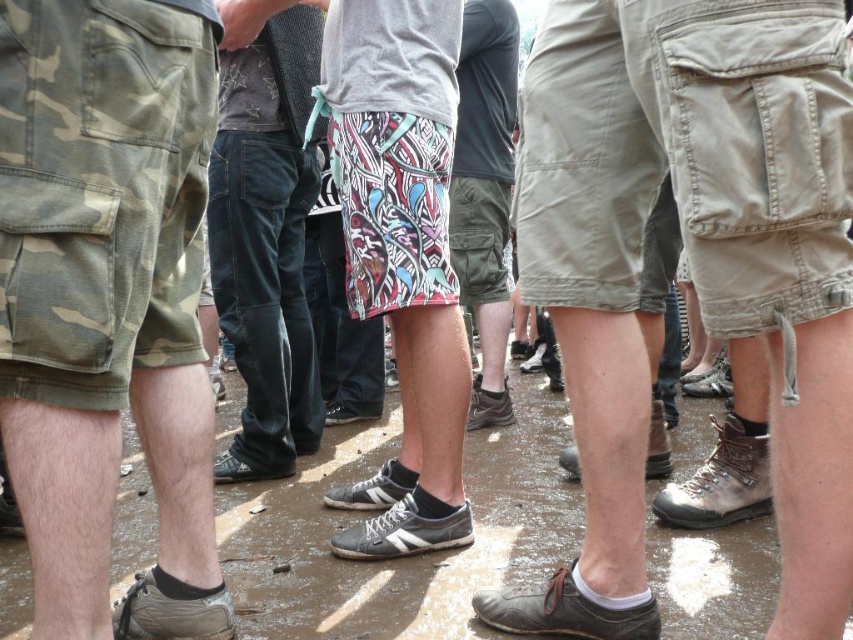
Can you confirm if camo fabric shorts at left is bigger than multicolored printed shorts at center?

Yes.

Can you confirm if camo fabric shorts at left is thinner than multicolored printed shorts at center?

Yes.

Where is `camo fabric shorts at left`? The height and width of the screenshot is (640, 853). camo fabric shorts at left is located at coordinates (102, 192).

At what (x,y) coordinates should I click in order to perform the action: click on camo fabric shorts at left. Please return your answer as a coordinate pair (x, y). This screenshot has height=640, width=853. Looking at the image, I should click on (102, 192).

Does khaki cotton shorts at right have a greater height compared to denim jeans at center?

In fact, khaki cotton shorts at right may be shorter than denim jeans at center.

Is point (631, 186) more distant than point (270, 236)?

That is False.

Which is behind, point (842, 93) or point (234, 224)?

The point (234, 224) is more distant.

This screenshot has width=853, height=640. I want to click on khaki cotton shorts at right, so click(751, 150).

Who is more forward, (26,230) or (282,108)?

Positioned in front is point (26,230).

Measure the distance from camo fabric shorts at left to denim jeans at center.

They are 5.59 feet apart.

I want to click on camo fabric shorts at left, so click(x=102, y=192).